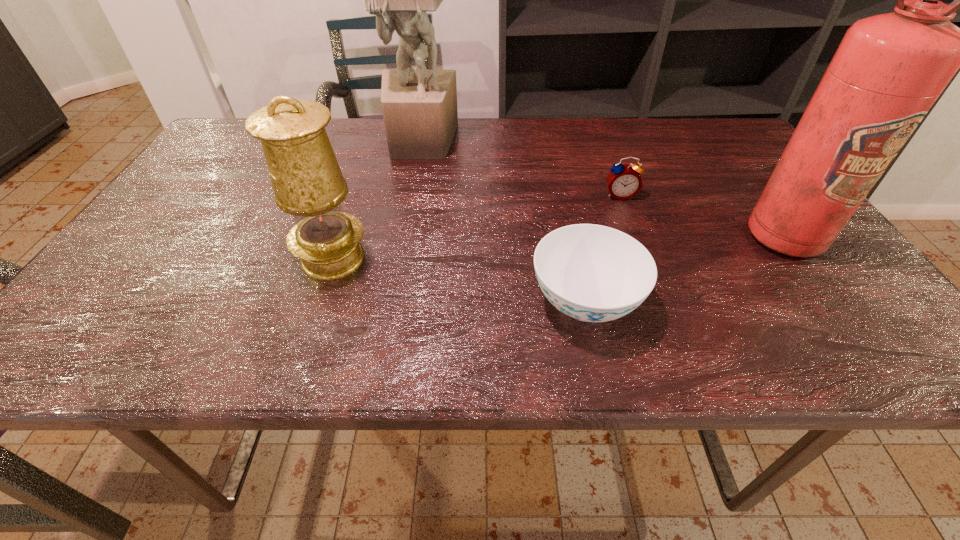
Find the location of a particular element. The width and height of the screenshot is (960, 540). the farthest object is located at coordinates (419, 106).

Locate an element on the screen. fire extinguisher is located at coordinates (889, 69).

You are a GUI agent. You are given a task and a screenshot of the screen. Output one action in this format:
    pyautogui.click(x=<x>, y=<y>)
    Task: Click on the oil lamp
    The height and width of the screenshot is (540, 960).
    Given the screenshot: What is the action you would take?
    pyautogui.click(x=307, y=181)

Image resolution: width=960 pixels, height=540 pixels. Find the location of `the fourth nearest object`. the fourth nearest object is located at coordinates (624, 181).

Find the location of `chinaware`. chinaware is located at coordinates (592, 273).

Locate an element on the screen. free spot located 0.120m on the front-facing side of the farthest object is located at coordinates (413, 188).

Where is `vacant space located 0.230m on the label side of the rightmost object`? Image resolution: width=960 pixels, height=540 pixels. vacant space located 0.230m on the label side of the rightmost object is located at coordinates (873, 360).

Locate an element on the screen. The height and width of the screenshot is (540, 960). free space located 0.260m on the back of the oil lamp is located at coordinates (363, 169).

Locate an element on the screen. vacant space situated on the front-facing side of the alarm clock is located at coordinates (663, 314).

This screenshot has width=960, height=540. I want to click on vacant point located 0.180m on the right of the chinaware, so click(x=737, y=303).